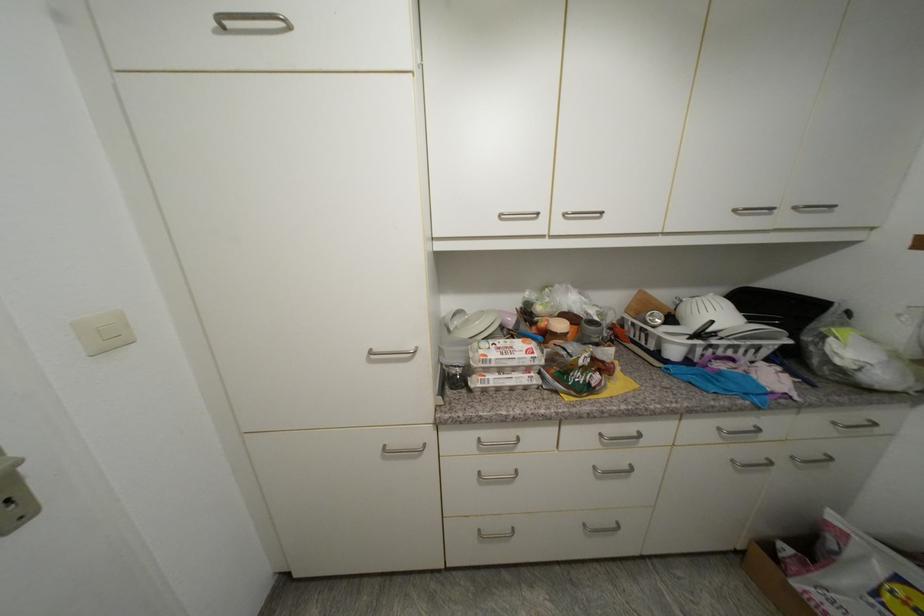
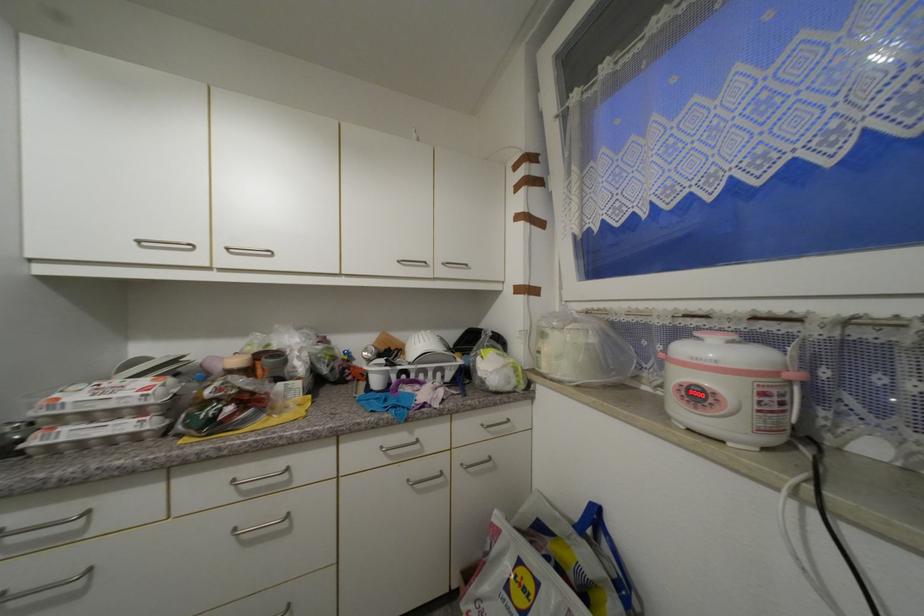
Find the pixel in the second image that matches pixel 740 213 in the first image.

(405, 262)